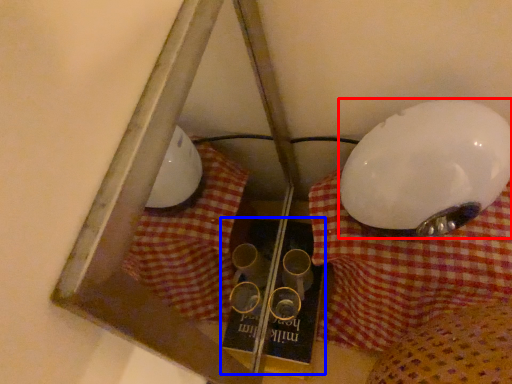
Question: Which object appears closest to the camera in this image, lamp (highlighted by a red box) or book (highlighted by a blue box)?

Choices:
 (A) lamp
 (B) book

Answer: (A)